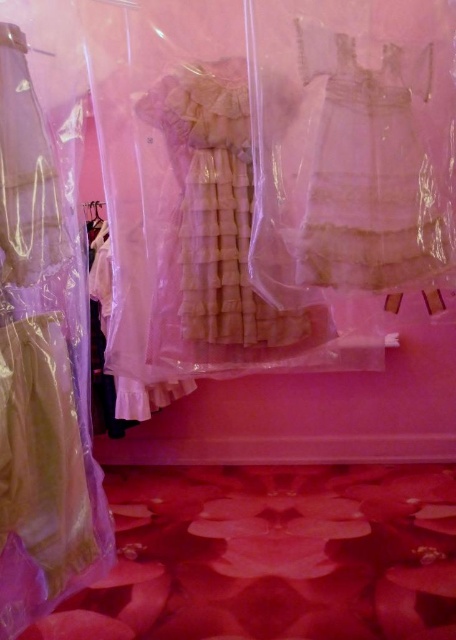
Does matte beige dress at center come behind white lace dress at center?

No, it is in front of white lace dress at center.

Is the position of matte beige dress at center less distant than that of white lace dress at center?

Yes, matte beige dress at center is in front of white lace dress at center.

Does point (46, 506) lie in front of point (430, 48)?

Yes.

The height and width of the screenshot is (640, 456). Identify the location of matte beige dress at center. (41, 369).

At what (x,y) coordinates should I click in order to perform the action: click on white lace dress at center. Please return your answer as a coordinate pair (x, y). The image size is (456, 640). Looking at the image, I should click on (374, 163).

Between white lace dress at center and light beige chiffon dress at center, which one is positioned higher?

white lace dress at center is above.

Is point (364, 100) positioned behind point (200, 184)?

No.

Where is `white lace dress at center`? Image resolution: width=456 pixels, height=640 pixels. white lace dress at center is located at coordinates (374, 163).

Does matte beige dress at center have a lesser width compared to light beige chiffon dress at center?

Yes.

The image size is (456, 640). I want to click on matte beige dress at center, so click(x=41, y=369).

Locate an element on the screen. This screenshot has height=640, width=456. matte beige dress at center is located at coordinates (41, 369).